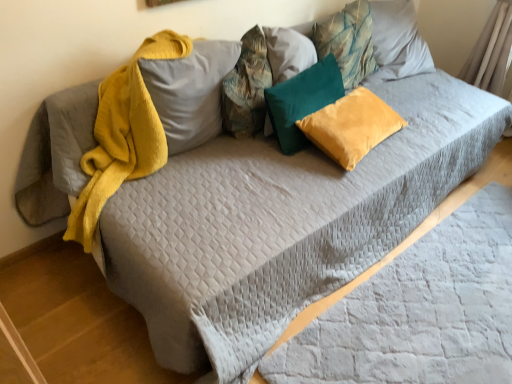
Question: Relative to gray quilted sheet at lower right, is teal velvet pillow at center, which ranks as the 3th pillow in left-to-right order, in front or behind?

Choices:
 (A) front
 (B) behind

Answer: (B)

Question: From the image's perspective, is teal velvet pillow at center, the 3th pillow viewed from the right, above or below gray quilted sheet at lower right?

Choices:
 (A) below
 (B) above

Answer: (B)

Question: Which object is the closest to the textured fabric pillow at center, the fourth pillow positioned from the right?

Choices:
 (A) velvet yellow pillow at center, which is the second pillow in right-to-left order
 (B) gray quilted sheet at lower right
 (C) teal velvet pillow at center, the 3th pillow viewed from the right
 (D) teal fabric pillow at upper center, placed as the 5th pillow when sorted from left to right
 (E) fuzzy yellow pillow at upper center, which ranks as the 5th pillow in right-to-left order

Answer: (E)

Question: Which of these objects is positioned farthest from the gray quilted sheet at lower right?

Choices:
 (A) fuzzy yellow pillow at upper center, which ranks as the 5th pillow in right-to-left order
 (B) textured fabric pillow at center, positioned as the second pillow in left-to-right order
 (C) teal fabric pillow at upper center, placed as the 5th pillow when sorted from left to right
 (D) velvet yellow pillow at center, which is the second pillow in right-to-left order
 (E) teal velvet pillow at center, which ranks as the 3th pillow in left-to-right order

Answer: (C)